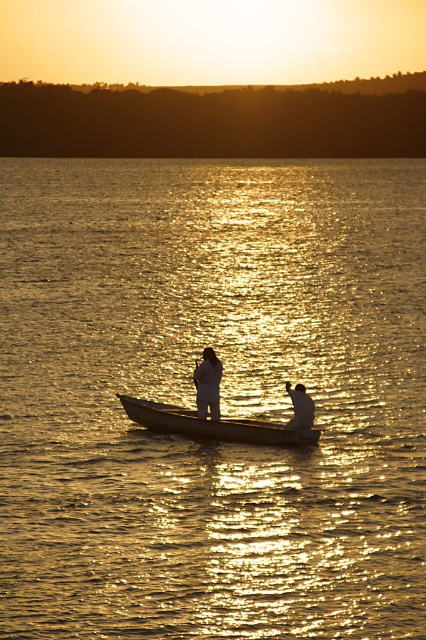
Can you confirm if silhouette clothing at center is positioned to the right of silvery metallic rod at center?

Incorrect, silhouette clothing at center is not on the right side of silvery metallic rod at center.

Who is more forward, [209,353] or [302,417]?

Point [302,417] is in front.

What do you see at coordinates (207, 384) in the screenshot? I see `silhouette clothing at center` at bounding box center [207, 384].

The width and height of the screenshot is (426, 640). What are the coordinates of `silhouette clothing at center` in the screenshot? It's located at [207, 384].

Is wooden paddle at center bigger than silhouette clothing at center?

Yes.

Based on the photo, is wooden paddle at center further to the viewer compared to silhouette clothing at center?

That is True.

Where is `wooden paddle at center`? wooden paddle at center is located at coordinates (229, 426).

Does wooden canoe at center have a lesser width compared to wooden paddle at center?

No, wooden canoe at center is not thinner than wooden paddle at center.

Who is higher up, wooden canoe at center or wooden paddle at center?

wooden canoe at center is higher up.

Where is `wooden canoe at center`? This screenshot has height=640, width=426. wooden canoe at center is located at coordinates (213, 424).